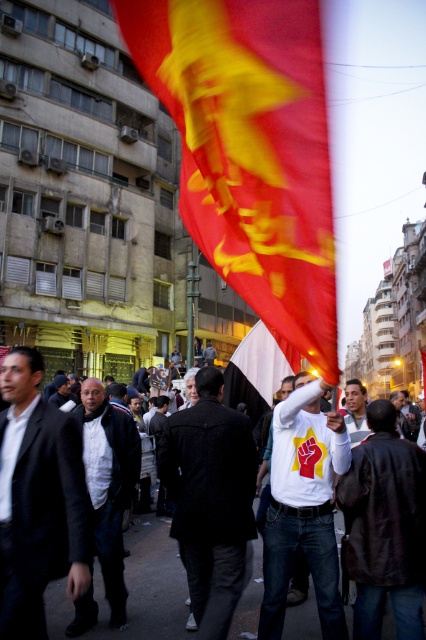
Question: Which is nearer to the black suit at left?

Choices:
 (A) matte black jacket at center
 (B) white t-shirt at center
 (C) black matte jacket at center
 (D) white matte flag at center

Answer: (C)

Question: Is black textured coat at center thinner than black matte jacket at center?

Choices:
 (A) no
 (B) yes

Answer: (B)

Question: Does black matte jacket at center have a larger size compared to white matte flag at center?

Choices:
 (A) no
 (B) yes

Answer: (A)

Question: Which of these objects is positioned closest to the white t-shirt at center?

Choices:
 (A) white matte t-shirt at center
 (B) red/yellow fabric flag at center
 (C) white matte flag at center

Answer: (C)

Question: Is black suit at left smaller than dark brown leather jacket at center?

Choices:
 (A) no
 (B) yes

Answer: (B)

Question: Which of these objects is positioned closest to the black matte jacket at center?

Choices:
 (A) white matte flag at center
 (B) white matte t-shirt at center
 (C) black suit at left
 (D) white t-shirt at center

Answer: (C)